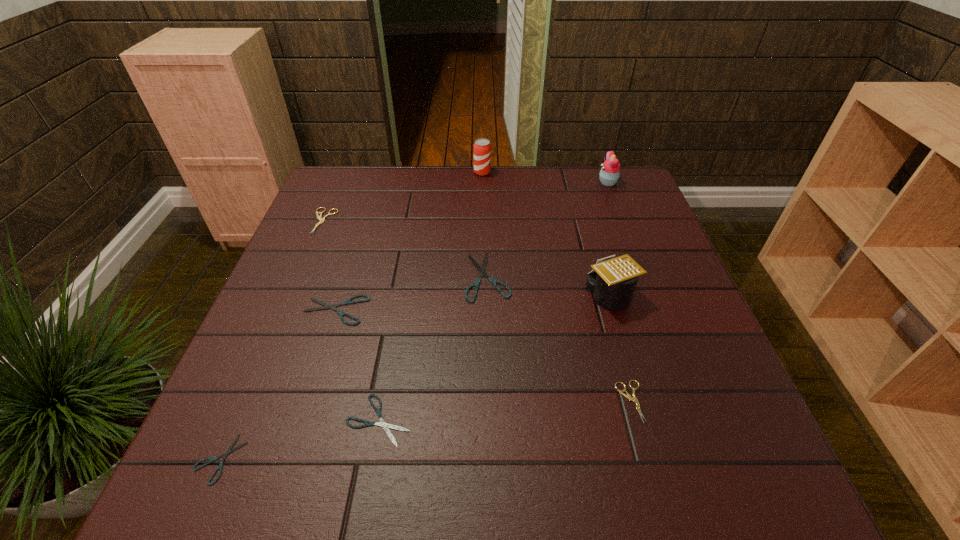
The height and width of the screenshot is (540, 960). I want to click on vacant region located 0.170m on the left of the second shears from right to left, so pos(396,276).

The width and height of the screenshot is (960, 540). In order to click on vacant space situated on the right of the left beige shears in this screenshot , I will do `click(456, 221)`.

I want to click on free space located 0.250m on the back of the third black shears from right to left, so click(x=361, y=230).

Identify the location of free region located 0.330m on the back of the smaller beige shears. (594, 267).

The height and width of the screenshot is (540, 960). Identify the location of vacant space located 0.180m on the back of the second black shears from right to left. (396, 322).

You are a GUI agent. You are given a task and a screenshot of the screen. Output one action in this format:
    pyautogui.click(x=<x>, y=<y>)
    Task: Click on the beer can present at the far edge
    
    Given the screenshot: What is the action you would take?
    pyautogui.click(x=482, y=148)

The height and width of the screenshot is (540, 960). I want to click on cupcake located in the far edge section of the desktop, so click(x=610, y=172).

Locate an element on the screen. This screenshot has height=540, width=960. shears that is at the far edge is located at coordinates (321, 220).

Find the location of a particular element. The width and height of the screenshot is (960, 540). object that is at the near edge is located at coordinates (229, 450).

The image size is (960, 540). In order to click on cupcake located in the right edge section of the desktop in this screenshot , I will do `click(610, 172)`.